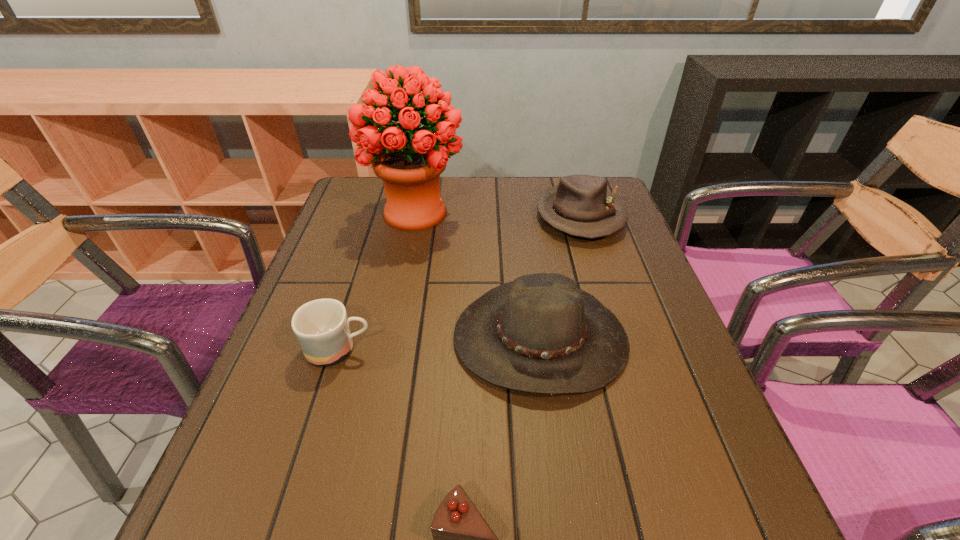
Locate an element on the screen. free space at the near left corner of the desktop is located at coordinates (233, 537).

The width and height of the screenshot is (960, 540). In the image, there is a desktop. Find the location of `vacant space at the near right corner`. vacant space at the near right corner is located at coordinates (680, 518).

This screenshot has height=540, width=960. I want to click on free space between the tallest object and the mug, so click(377, 281).

At what (x,y) coordinates should I click in order to perform the action: click on free space between the second tallest object and the mug. Please return your answer as a coordinate pair (x, y). The height and width of the screenshot is (540, 960). Looking at the image, I should click on (440, 343).

Locate an element on the screen. free spot between the farther hat and the tallest object is located at coordinates (497, 214).

In order to click on free area in between the mug and the fourth shortest object in this screenshot , I will do `click(440, 343)`.

Identify the location of vacant space that's between the taller hat and the tallest object. Image resolution: width=960 pixels, height=540 pixels. (478, 275).

Select which object is the fourth closest to the shortest object. Please provide its 2D coordinates. Your answer should be formatted as a tuple, i.e. [(x, y)], where the tuple contains the x and y coordinates of a point satisfying the conditions above.

[(409, 159)]

Find the location of a particular element. This screenshot has height=540, width=960. object that stands as the fourth closest to the nearest object is located at coordinates (409, 159).